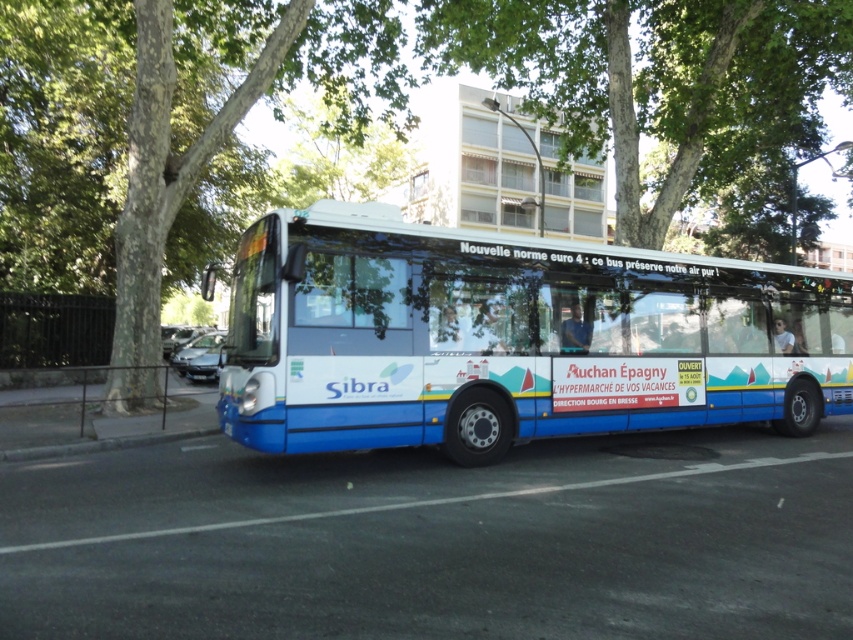
Does blue metallic bus at center appear on the left side of green leafy tree at upper center?

No, blue metallic bus at center is not to the left of green leafy tree at upper center.

Does blue metallic bus at center have a larger size compared to green leafy tree at upper center?

No.

What do you see at coordinates (511, 337) in the screenshot? The width and height of the screenshot is (853, 640). I see `blue metallic bus at center` at bounding box center [511, 337].

Locate an element on the screen. blue metallic bus at center is located at coordinates (511, 337).